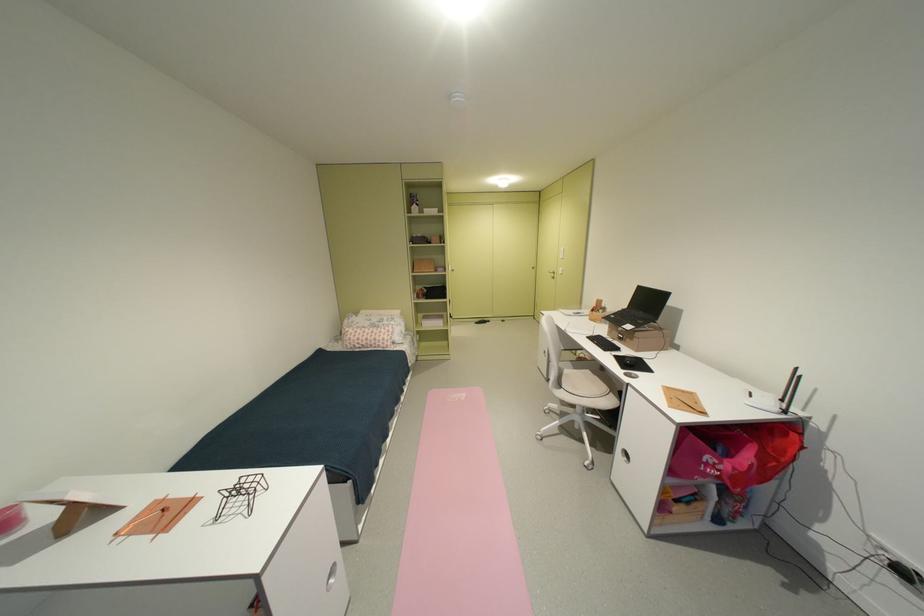
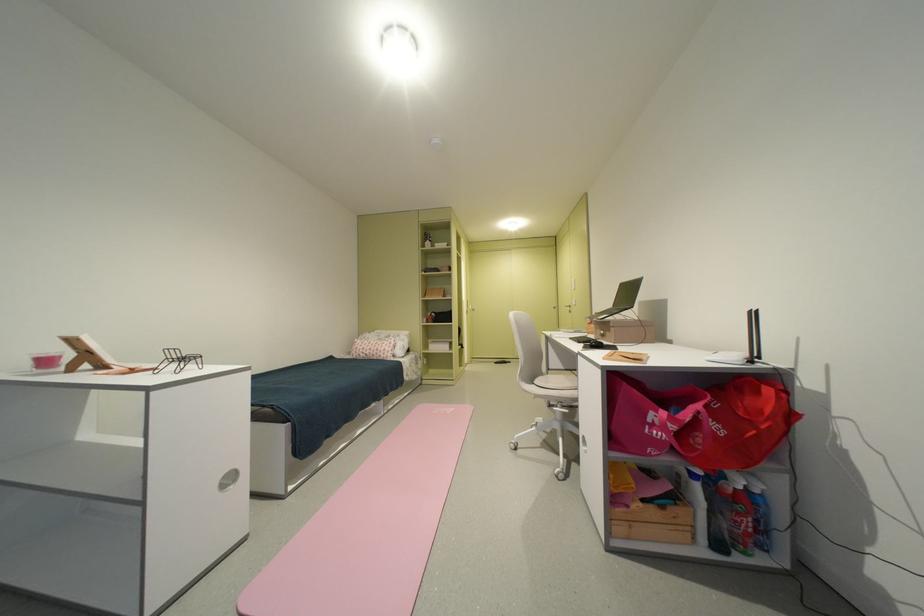
Where in the second image is the point corresponding to the point at 570,274 from the first image?

(584, 305)